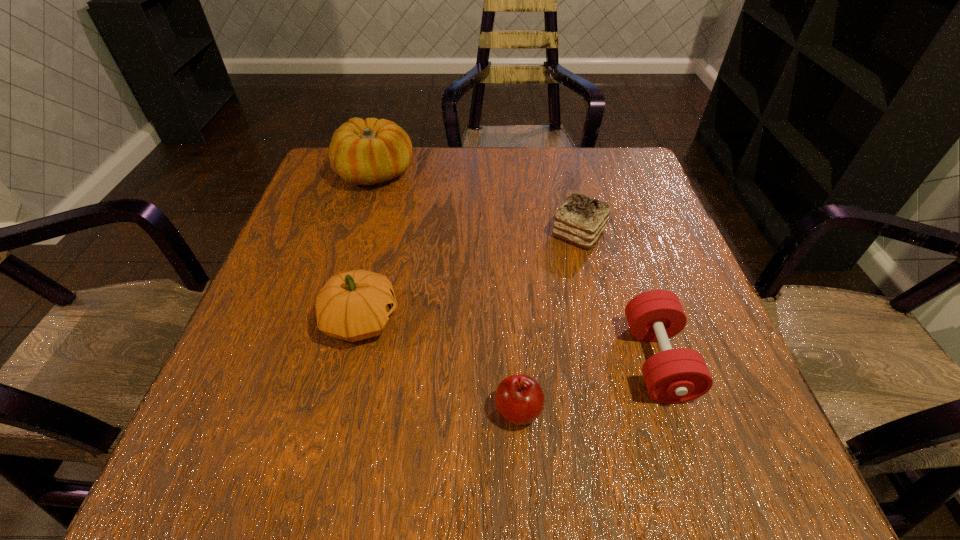
Locate an element on the screen. The height and width of the screenshot is (540, 960). free point between the nearer gourd and the apple is located at coordinates (440, 366).

You are a GUI agent. You are given a task and a screenshot of the screen. Output one action in this format:
    pyautogui.click(x=<x>, y=<y>)
    Task: Click on the closest object relative to the farthest object
    
    Given the screenshot: What is the action you would take?
    pyautogui.click(x=355, y=305)

Find the location of `object that can be found as the fourth closest to the farther gourd`. object that can be found as the fourth closest to the farther gourd is located at coordinates (678, 375).

The image size is (960, 540). In order to click on free spot that satisfies the following two spatial constraints: 1. on the side of the dumbbell with the carved face; 2. on the right side of the nearer gourd in this screenshot , I will do `click(351, 361)`.

Locate an element on the screen. vacant point that satisfies the following two spatial constraints: 1. on the side of the apple with the carved face; 2. on the right side of the nearer gourd is located at coordinates (340, 410).

Identify the location of free location that satisfies the following two spatial constraints: 1. on the side of the nearer gourd with the carved face; 2. on the left side of the dumbbell. Image resolution: width=960 pixels, height=540 pixels. (351, 361).

This screenshot has height=540, width=960. I want to click on vacant point that satisfies the following two spatial constraints: 1. on the side of the nearer gourd with the carved face; 2. on the left side of the apple, so click(340, 410).

Locate an element on the screen. free location that satisfies the following two spatial constraints: 1. on the side of the dumbbell with the carved face; 2. on the left side of the nearer gourd is located at coordinates (351, 361).

The width and height of the screenshot is (960, 540). I want to click on vacant space that satisfies the following two spatial constraints: 1. on the front side of the farthest object; 2. on the left side of the dumbbell, so tap(320, 361).